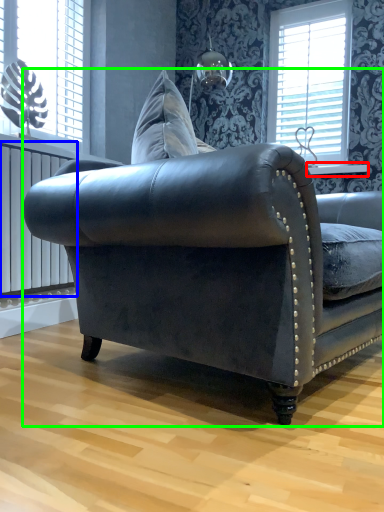
Question: Which object is positioned farthest from window sill (highlighted by a red box)? Select from radiator (highlighted by a blue box) and studio couch (highlighted by a green box).

Choices:
 (A) radiator
 (B) studio couch

Answer: (B)